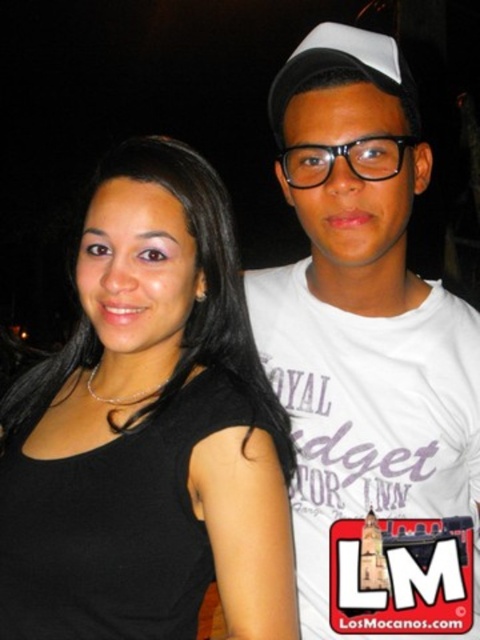
You are a photographer trying to capture a closeup shot of the white matte baseball cap at upper center without including the black matte tank top at upper left in the frame. Given their relative widths, is this possible?

The black matte tank top at upper left is wider than the white matte baseball cap at upper center. Since the tank top is wider, it might be challenging to frame the cap without including part of the tank top, especially if they are positioned close together. Adjusting the camera angle or moving closer to the cap could help isolate it in the shot.

Based on the photo, you are a photographer trying to capture a clear shot of both the black matte tank top at upper left and the white matte baseball cap at upper center. Since you want both items to appear equally prominent in the photo, which adjustment should you make to the camera settings or your position?

Since the black matte tank top at upper left is bigger than the white matte baseball cap at upper center, you should move the camera further away from the black matte tank top at upper left to reduce its size in the frame, making both items appear more balanced in prominence.